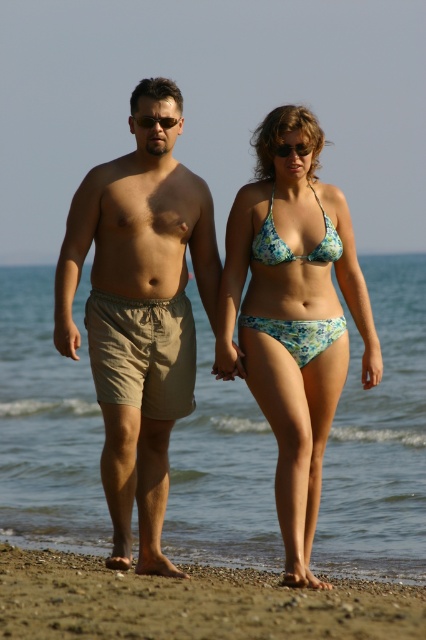
Between floral print bikini top at center and black plastic sunglasses at center, which one has less height?

With less height is black plastic sunglasses at center.

Who is more forward, (328,252) or (170,120)?

Point (328,252) is more forward.

This screenshot has width=426, height=640. Find the location of `floral print bikini top at center`. floral print bikini top at center is located at coordinates pos(287,244).

Does floral print fabric bikini at center have a greater width compared to black plastic sunglasses at center?

Indeed, floral print fabric bikini at center has a greater width compared to black plastic sunglasses at center.

Does point (259, 252) come closer to viewer compared to point (150, 115)?

Yes, it is in front of point (150, 115).

Does point (255, 320) come behind point (175, 120)?

No.

Image resolution: width=426 pixels, height=640 pixels. What are the coordinates of `floral print fabric bikini at center` in the screenshot? It's located at pyautogui.click(x=299, y=333).

Does tan fabric shorts at left have a lesser height compared to floral bikini at center?

In fact, tan fabric shorts at left may be taller than floral bikini at center.

At what (x,y) coordinates should I click in order to perform the action: click on tan fabric shorts at left. Please return your answer as a coordinate pair (x, y). This screenshot has height=640, width=426. Looking at the image, I should click on (138, 320).

Where is `tan fabric shorts at left`? tan fabric shorts at left is located at coordinates (138, 320).